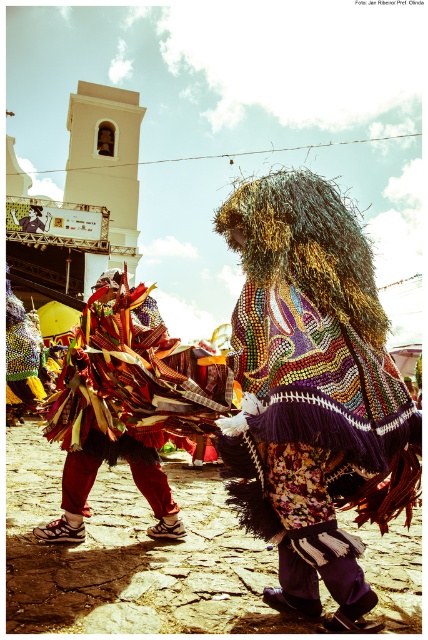
Question: Is beaded fabric cape at center to the right of bright red fabric at center from the viewer's perspective?

Choices:
 (A) yes
 (B) no

Answer: (A)

Question: Which object is closer to the camera taking this photo?

Choices:
 (A) bright red fabric at center
 (B) beaded fabric cape at center

Answer: (B)

Question: Which point is farther from the camera taking this photo?

Choices:
 (A) (65, 483)
 (B) (281, 483)

Answer: (A)

Question: Is beaded fabric cape at center below bright red fabric at center?

Choices:
 (A) yes
 (B) no

Answer: (B)

Question: Is the position of beaded fabric cape at center more distant than that of bright red fabric at center?

Choices:
 (A) no
 (B) yes

Answer: (A)